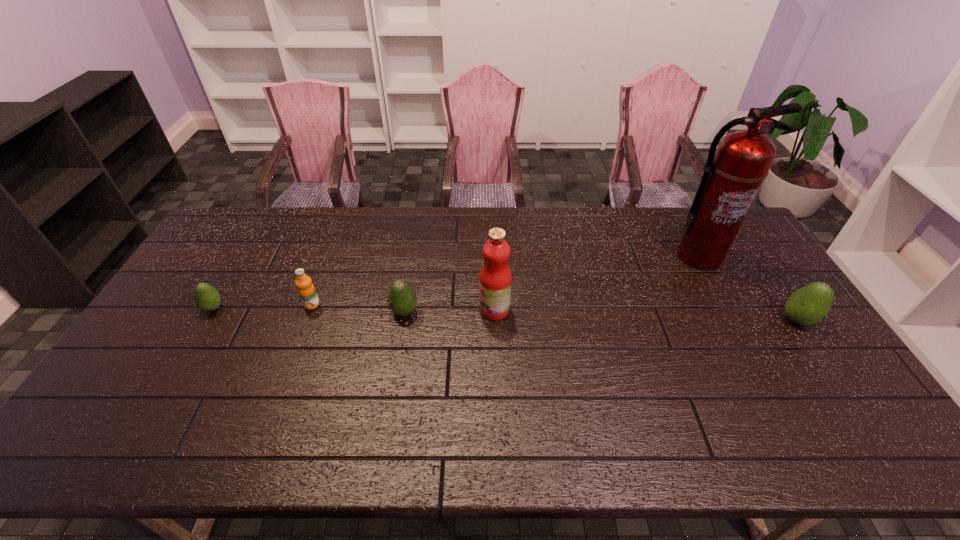
What are the coordinates of `vacant spot for a new avocado to ensure equal spacing` in the screenshot? It's located at (599, 316).